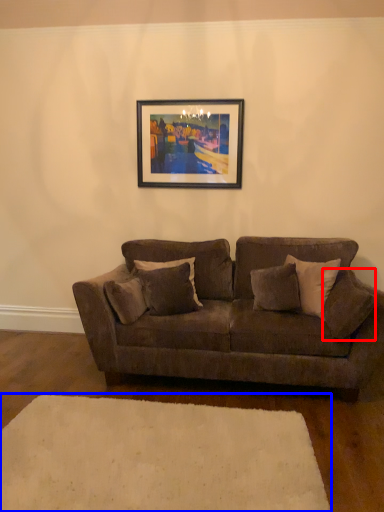
Question: Which point is closer to the camera, pillow (highlighted by a red box) or plain (highlighted by a blue box)?

Choices:
 (A) pillow
 (B) plain

Answer: (B)